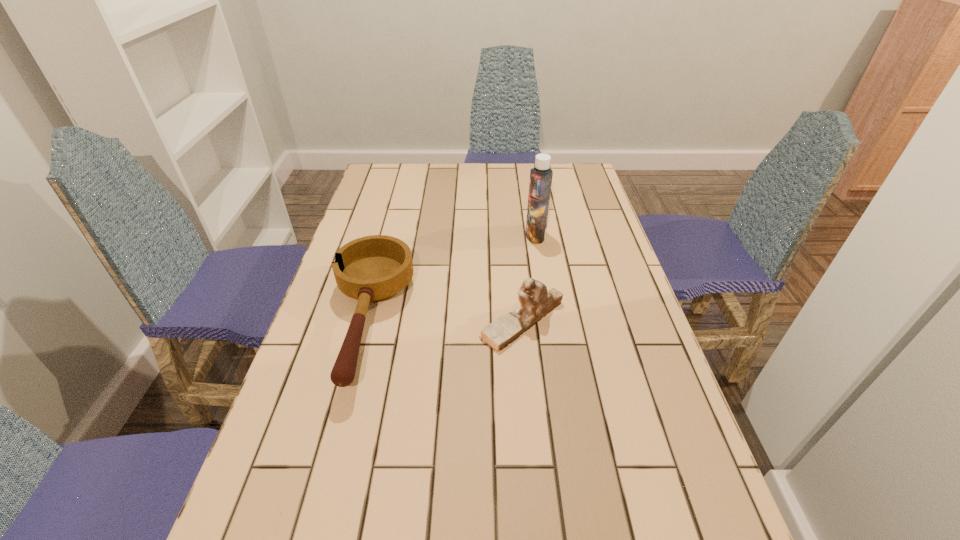
Locate an element on the screen. shampoo is located at coordinates (541, 175).

Identify the location of the farthest object. (541, 175).

The image size is (960, 540). Identify the location of figurine. (536, 301).

I want to click on the shortest object, so click(375, 268).

Where is `the leftmost object`? the leftmost object is located at coordinates (375, 268).

At what (x,y) coordinates should I click in order to perform the action: click on free space located on the front label of the tallest object. Please return your answer as a coordinate pair (x, y). Image resolution: width=960 pixels, height=540 pixels. Looking at the image, I should click on (461, 235).

Find the location of `free region located on the front label of the tallest object`. free region located on the front label of the tallest object is located at coordinates (490, 235).

Identify the location of free spot located on the front label of the tallest object. This screenshot has width=960, height=540. (445, 235).

The height and width of the screenshot is (540, 960). What are the coordinates of `free space located 0.280m on the front-facing side of the figurine` in the screenshot? It's located at (367, 320).

The width and height of the screenshot is (960, 540). What are the coordinates of `blank space located 0.310m on the front-facing side of the figurine` in the screenshot? It's located at (355, 320).